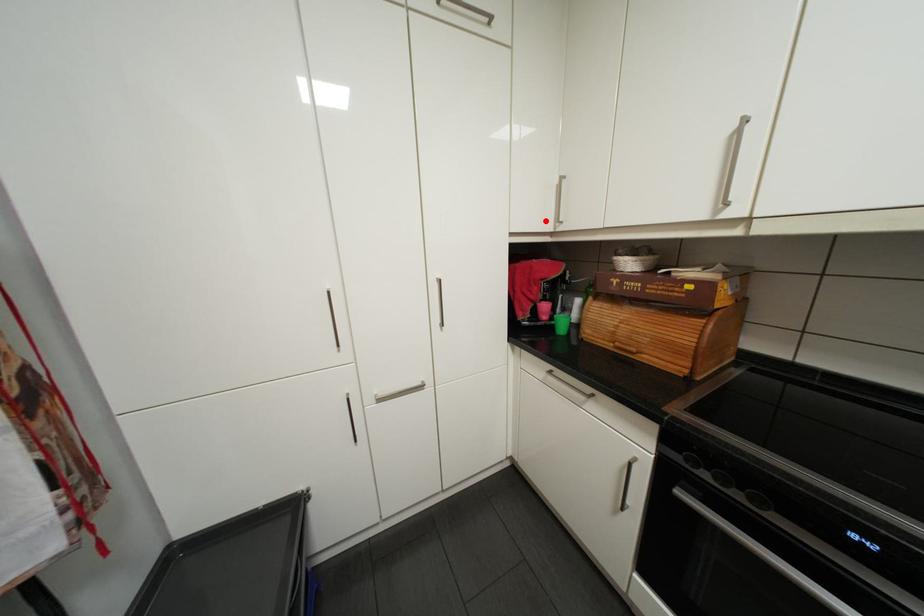
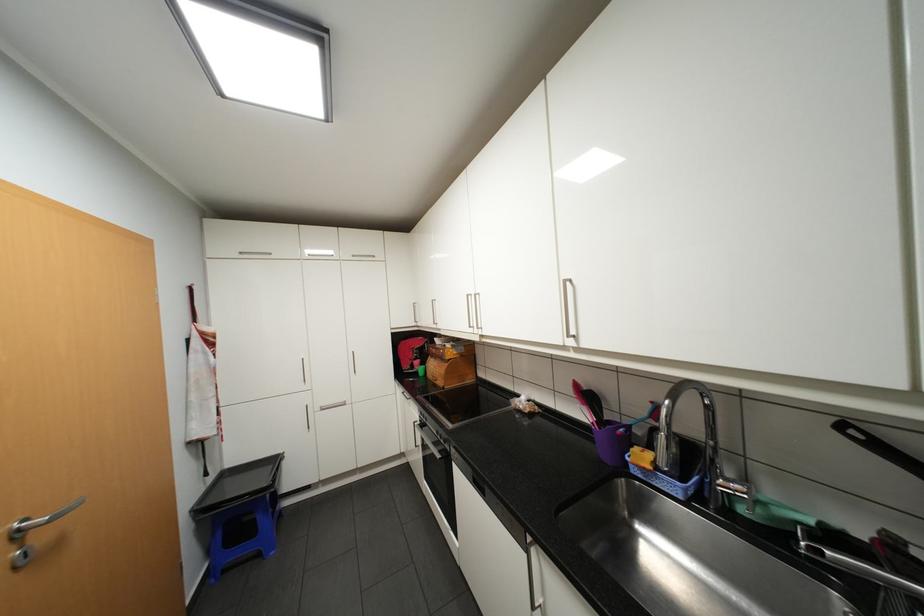
The point at the highlighted location is marked in the first image. Where is the corresponding point in the second image?

(412, 322)